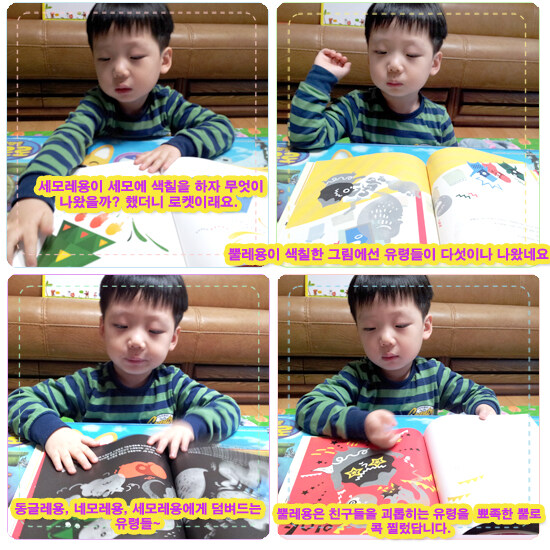
Where is `book`? book is located at coordinates (412, 476), (156, 472), (139, 242), (446, 212).